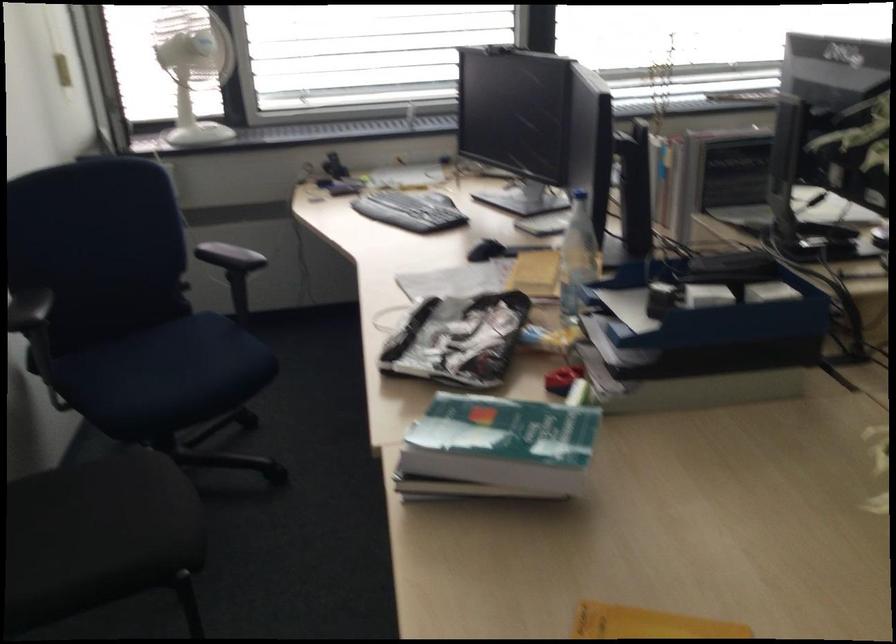
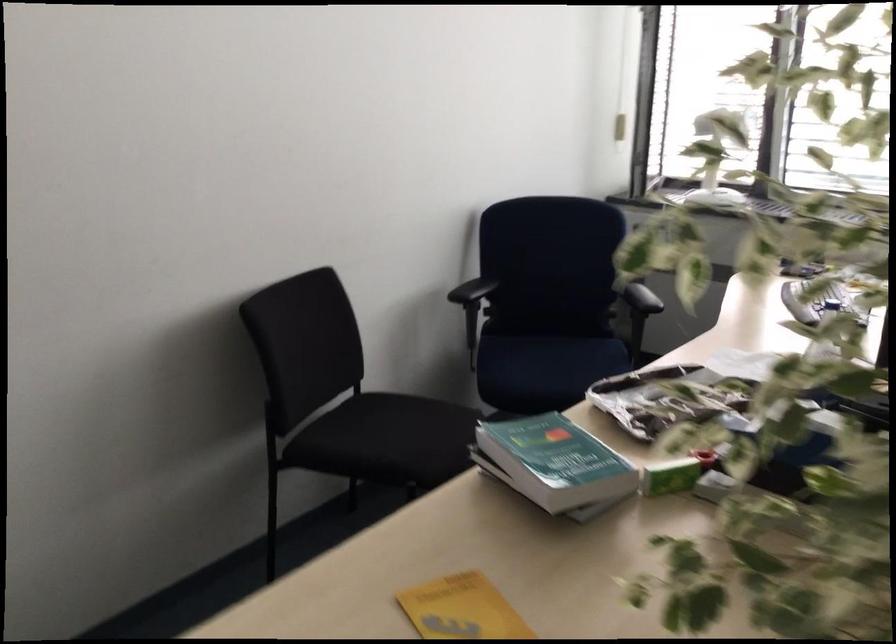
Where in the second image is the point corresponding to (85,551) from the first image?

(377, 436)